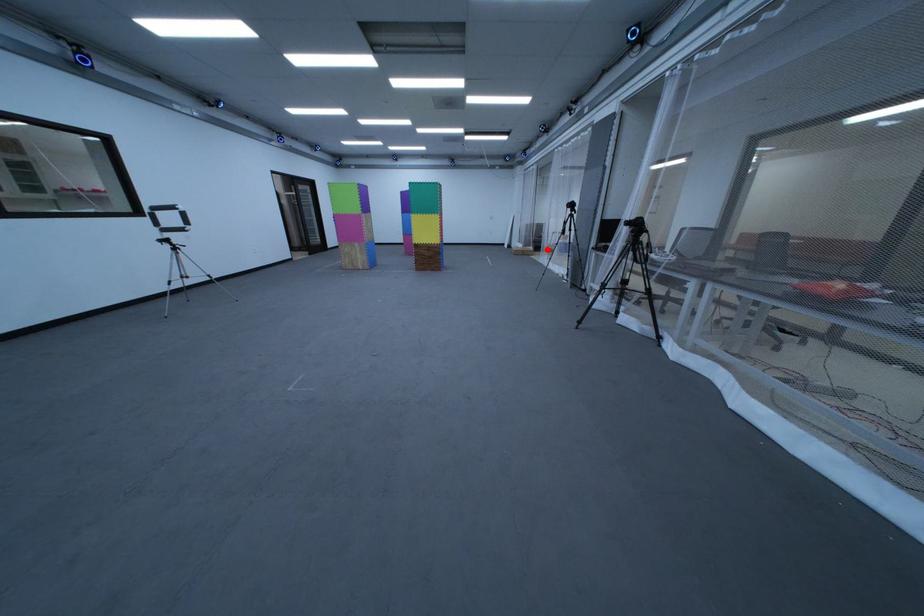
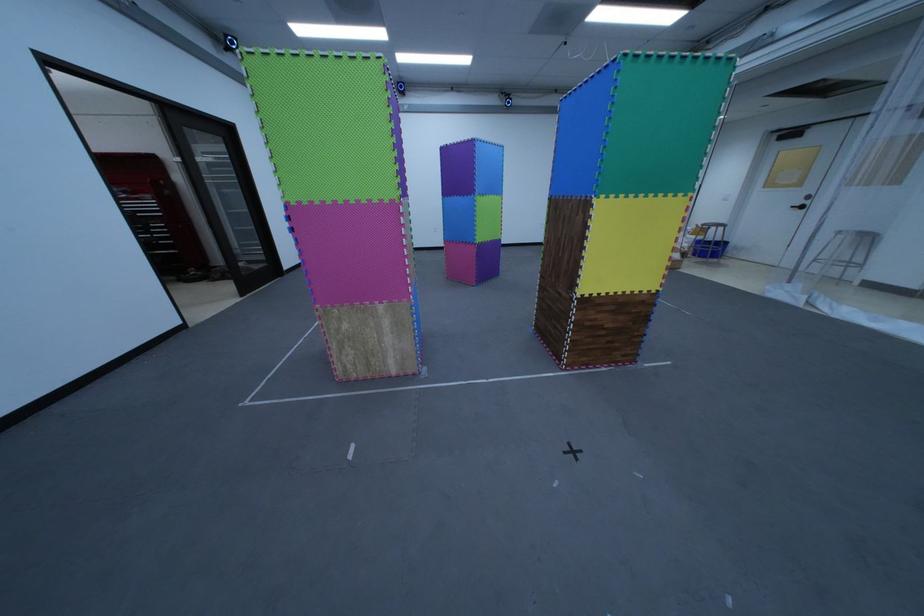
Question: I am providing you with two images of the same scene from different viewpoints. A red point is shown in image1. For the corresponding object point in image2, is it positioned nearer or farther from the camera?

Choices:
 (A) Nearer
 (B) Farther

Answer: (B)